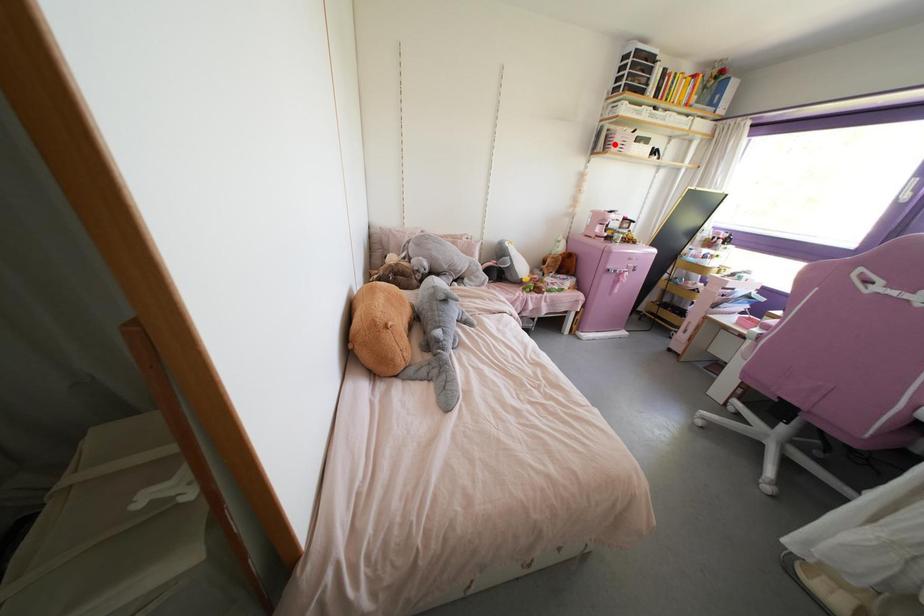
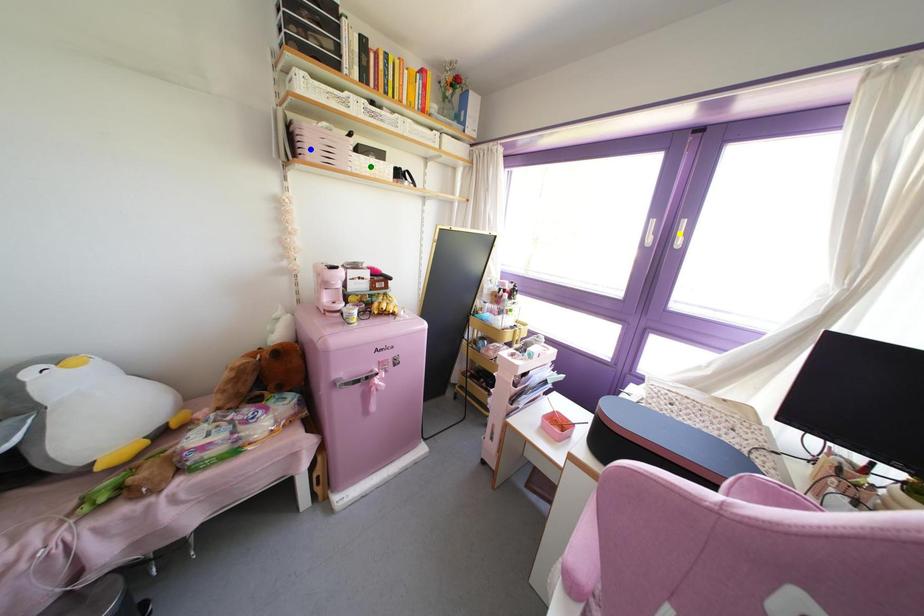
Question: I am providing you with two images of the same scene from different viewpoints. A red point is marked on the first image. You are given multiple points on the second image. In image 2, which mark is for the same physical point as the one in image 1?

Choices:
 (A) blue point
 (B) green point
 (C) yellow point

Answer: (A)